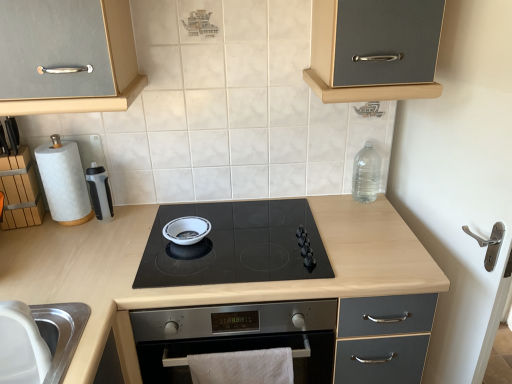
The image size is (512, 384). I want to click on free space in front of black plastic water bottle at left, so click(89, 246).